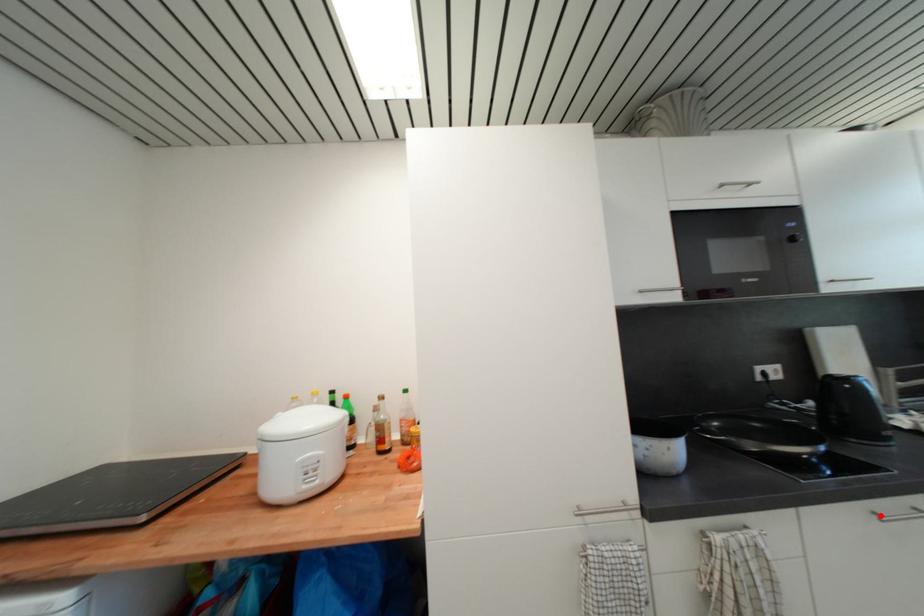
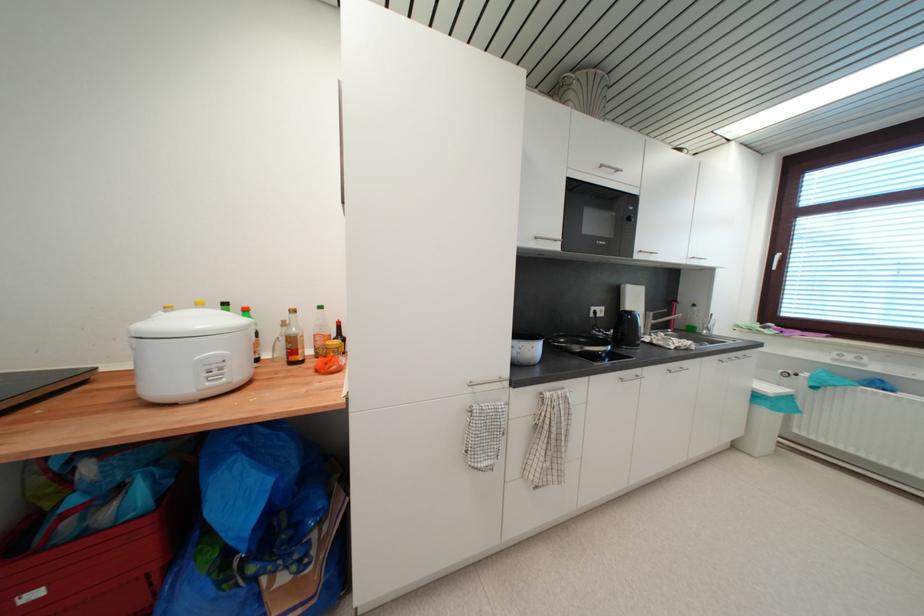
Question: I am providing you with two images of the same scene from different viewpoints. Image1 has a red point marked. In image2, the corresponding 3D location appears at what relative position? Reply with the corresponding letter.

Choices:
 (A) Closer
 (B) Farther

Answer: (B)